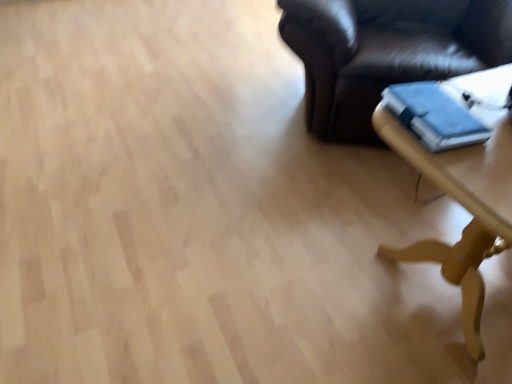
Describe the element at coordinates (434, 116) in the screenshot. I see `blue matte book at right` at that location.

What are the coordinates of `blue matte book at right` in the screenshot? It's located at (434, 116).

In order to face light brown wooden table at lower right, should I rotate leftwards or rightwards?

You should rotate right by 32.403 degrees.

Image resolution: width=512 pixels, height=384 pixels. What do you see at coordinates (464, 190) in the screenshot?
I see `light brown wooden table at lower right` at bounding box center [464, 190].

Where is `light brown wooden table at lower right`? Image resolution: width=512 pixels, height=384 pixels. light brown wooden table at lower right is located at coordinates 464,190.

Where is `blue matte book at right`? Image resolution: width=512 pixels, height=384 pixels. blue matte book at right is located at coordinates (434, 116).

Which is more to the right, blue matte book at right or light brown wooden table at lower right?

From the viewer's perspective, light brown wooden table at lower right appears more on the right side.

Is blue matte book at right further to the viewer compared to light brown wooden table at lower right?

Yes, blue matte book at right is further from the viewer.

Is point (438, 139) positioned after point (484, 221)?

That is True.

From the image's perspective, is blue matte book at right beneath light brown wooden table at lower right?

No, from the image's perspective, blue matte book at right is not below light brown wooden table at lower right.

From a real-world perspective, is blue matte book at right on light brown wooden table at lower right?

Yes, from a real-world perspective, blue matte book at right is above light brown wooden table at lower right.

Which of these two, blue matte book at right or light brown wooden table at lower right, is wider?

light brown wooden table at lower right.

From their relative heights in the image, would you say blue matte book at right is taller or shorter than light brown wooden table at lower right?

Clearly, blue matte book at right is shorter compared to light brown wooden table at lower right.

Which of these two, blue matte book at right or light brown wooden table at lower right, is bigger?

Bigger between the two is light brown wooden table at lower right.

Is blue matte book at right inside the boundaries of light brown wooden table at lower right, or outside?

blue matte book at right is not inside light brown wooden table at lower right, it's outside.

Is blue matte book at right directly adjacent to light brown wooden table at lower right?

Indeed, blue matte book at right and light brown wooden table at lower right are beside each other and touching.

Looking at this image, is blue matte book at right positioned with its back to light brown wooden table at lower right?

No.

What's the angular difference between blue matte book at right and light brown wooden table at lower right's facing directions?

3.32 degrees.

How much distance is there between blue matte book at right and light brown wooden table at lower right?

blue matte book at right and light brown wooden table at lower right are 2.60 inches apart from each other.

What are the coordinates of `book above the light brown wooden table at lower right (from the image's perspective)` in the screenshot? It's located at (434, 116).

Is light brown wooden table at lower right to the left or to the right of blue matte book at right in the image?

In the image, light brown wooden table at lower right appears on the right side of blue matte book at right.

Which object is more forward, light brown wooden table at lower right or blue matte book at right?

light brown wooden table at lower right is closer to the camera.

Which is more distant, (474,184) or (401,116)?

The point (401,116) is farther from the camera.

From the image's perspective, does light brown wooden table at lower right appear higher than blue matte book at right?

No.

From a real-world perspective, is light brown wooden table at lower right positioned under blue matte book at right based on gravity?

Yes.

Does light brown wooden table at lower right have a greater width compared to blue matte book at right?

Yes.

Which of these two, light brown wooden table at lower right or blue matte book at right, stands shorter?

With less height is blue matte book at right.

Is light brown wooden table at lower right bigger or smaller than blue matte book at right?

Considering their sizes, light brown wooden table at lower right takes up more space than blue matte book at right.

Could blue matte book at right be considered to be inside light brown wooden table at lower right?

That's incorrect, blue matte book at right is not inside light brown wooden table at lower right.

Is light brown wooden table at lower right next to blue matte book at right and touching it?

Yes, light brown wooden table at lower right is in contact with blue matte book at right.

Is blue matte book at right at the back of light brown wooden table at lower right?

No, blue matte book at right is not at the back of light brown wooden table at lower right.

Locate an element on the screen. book on the left of light brown wooden table at lower right is located at coordinates (434, 116).

Where is `table in front of the blue matte book at right`? This screenshot has height=384, width=512. table in front of the blue matte book at right is located at coordinates (464, 190).

Find the location of `book on the left of light brown wooden table at lower right`. book on the left of light brown wooden table at lower right is located at coordinates (434, 116).